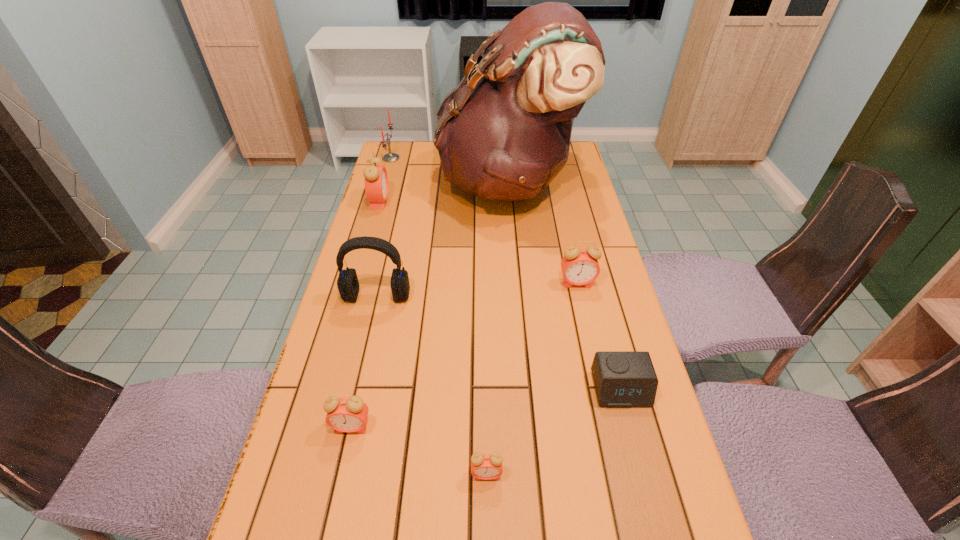
At what (x,y) coordinates should I click in order to perform the action: click on vacant region at the right edge. Please return your answer as a coordinate pair (x, y). The width and height of the screenshot is (960, 540). Looking at the image, I should click on (572, 339).

The width and height of the screenshot is (960, 540). In the image, there is a desktop. Find the location of `vacant space at the far left corner`. vacant space at the far left corner is located at coordinates pyautogui.click(x=402, y=160).

The image size is (960, 540). In order to click on empty space between the nearest alarm clock and the satchel in this screenshot , I will do `click(497, 328)`.

Image resolution: width=960 pixels, height=540 pixels. What are the coordinates of `vacant point located between the tallest alarm clock and the second tallest alarm clock` in the screenshot? It's located at (478, 242).

This screenshot has width=960, height=540. Find the location of `blank region between the candle and the black alarm clock`. blank region between the candle and the black alarm clock is located at coordinates [x=506, y=274].

Locate an element on the screen. vacant space that is in between the headset and the fourth alarm clock from right to left is located at coordinates (365, 361).

You are a GUI agent. You are given a task and a screenshot of the screen. Output one action in this format:
    pyautogui.click(x=<x>, y=<y>)
    Task: Click on the blank region between the candle and the sixth farthest object
    This screenshot has width=960, height=540.
    Given the screenshot: What is the action you would take?
    pyautogui.click(x=506, y=274)

Identify which object is located as the nearest to the satchel. Please provide its 2D coordinates. Your answer should be formatted as a tuple, i.e. [(x, y)], where the tuple contains the x and y coordinates of a point satisfying the conditions above.

[(389, 157)]

Locate which object is the closest to the third shortest alarm clock. Please provide its 2D coordinates. Your answer should be formatted as a tuple, i.e. [(x, y)], where the tuple contains the x and y coordinates of a point satisfying the conditions above.

[(486, 466)]

Identify the location of alarm clock that is the third closest to the headset. (579, 267).